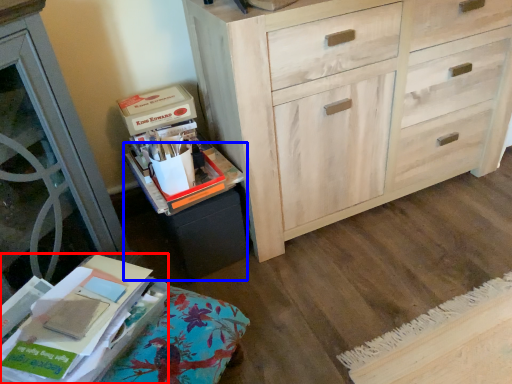
Question: Which of the following is the closest to the observer, paperback book (highlighted by a red box) or cabinetry (highlighted by a blue box)?

Choices:
 (A) paperback book
 (B) cabinetry

Answer: (A)